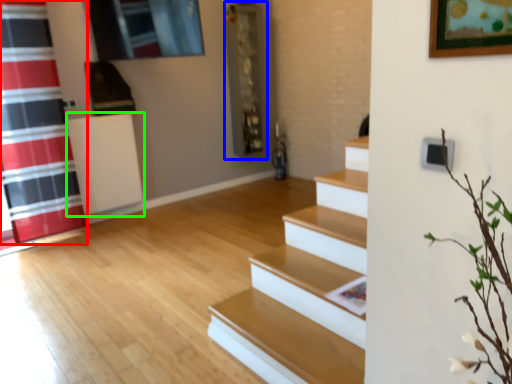
Question: Which object is positioned closest to shower curtain (highlighted by a red box)? Select from shelf (highlighted by a blue box) and radiator (highlighted by a green box).

Choices:
 (A) shelf
 (B) radiator

Answer: (B)